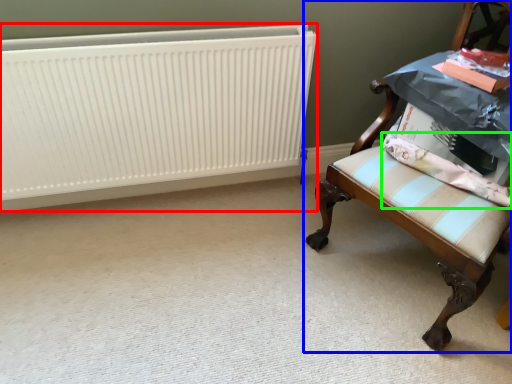
Question: Which object is positioned closest to radiator (highlighted by a red box)? Select from chair (highlighted by a blue box) and fabric (highlighted by a green box).

Choices:
 (A) chair
 (B) fabric

Answer: (A)